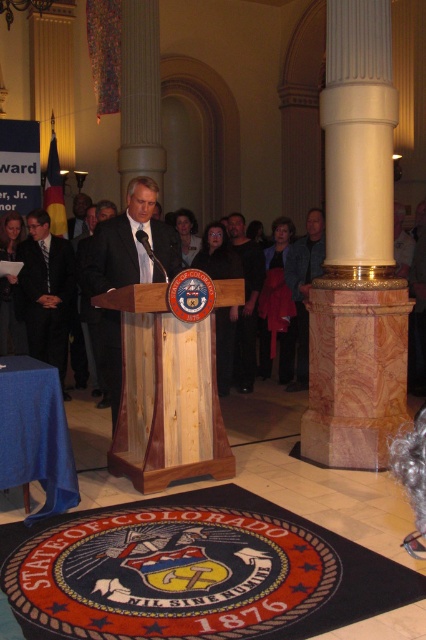
You are standing in the lobby and see the point marked at coordinates (356, 252). Which object is this point located on?

The point at (356, 252) is located on the white marble column at center.

Based on the photo, you are an event planner setting up a 4 foot wide banner between the white marble column at center and the natural wood podium at center. Will there be enough space for the banner?

The distance between the white marble column at center and the natural wood podium at center is 3.85 feet, which is less than the 4 foot width of the banner. Therefore, there is not enough space to place the banner between them.